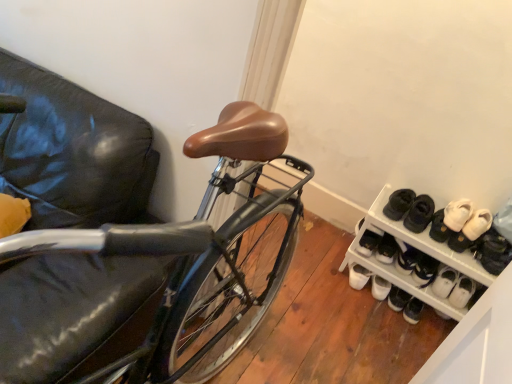
Question: Considering the relative positions of white suede sneakers at lower right, positioned as the 1th footwear in right-to-left order, and white suede shoes at right, which ranks as the 2th footwear in left-to-right order, in the image provided, is white suede sneakers at lower right, positioned as the 1th footwear in right-to-left order, to the right of white suede shoes at right, which ranks as the 2th footwear in left-to-right order, from the viewer's perspective?

Choices:
 (A) yes
 (B) no

Answer: (A)

Question: Is white suede sneakers at lower right, positioned as the 1th footwear in right-to-left order, facing towards white suede shoes at right, which is counted as the 3th footwear, starting from the right?

Choices:
 (A) yes
 (B) no

Answer: (B)

Question: Is white suede sneakers at lower right, which ranks as the 4th footwear in left-to-right order, turned away from white suede shoes at right, which ranks as the 2th footwear in left-to-right order?

Choices:
 (A) no
 (B) yes

Answer: (A)

Question: From a real-world perspective, is white suede sneakers at lower right, positioned as the 1th footwear in right-to-left order, positioned under white suede shoes at right, which is counted as the 3th footwear, starting from the right, based on gravity?

Choices:
 (A) yes
 (B) no

Answer: (B)

Question: Does white suede sneakers at lower right, which ranks as the 4th footwear in left-to-right order, have a lesser height compared to white suede shoes at right, which ranks as the 2th footwear in left-to-right order?

Choices:
 (A) no
 (B) yes

Answer: (A)

Question: Does point (463, 339) appear closer or farther from the camera than point (501, 249)?

Choices:
 (A) closer
 (B) farther

Answer: (A)

Question: Is white plastic shoe rack at lower right in front of or behind white suede sneakers at lower right, positioned as the 1th footwear in right-to-left order, in the image?

Choices:
 (A) behind
 (B) front

Answer: (B)

Question: Is white plastic shoe rack at lower right to the left or to the right of white suede sneakers at lower right, which ranks as the 4th footwear in left-to-right order, in the image?

Choices:
 (A) right
 (B) left

Answer: (B)

Question: From their relative heights in the image, would you say white plastic shoe rack at lower right is taller or shorter than white suede sneakers at lower right, positioned as the 1th footwear in right-to-left order?

Choices:
 (A) short
 (B) tall

Answer: (B)

Question: Considering the positions of white suede sneakers at lower right, which ranks as the 4th footwear in left-to-right order, and white suede sneakers at lower right, the first footwear in the left-to-right sequence, in the image, is white suede sneakers at lower right, which ranks as the 4th footwear in left-to-right order, taller or shorter than white suede sneakers at lower right, the first footwear in the left-to-right sequence,?

Choices:
 (A) short
 (B) tall

Answer: (B)

Question: From the image's perspective, is white suede sneakers at lower right, positioned as the 1th footwear in right-to-left order, above or below white suede sneakers at lower right, the first footwear in the left-to-right sequence?

Choices:
 (A) above
 (B) below

Answer: (B)

Question: Would you say white suede sneakers at lower right, which ranks as the 4th footwear in left-to-right order, is to the left or to the right of white suede sneakers at lower right, the first footwear in the left-to-right sequence, in the picture?

Choices:
 (A) left
 (B) right

Answer: (B)

Question: Do you think white suede sneakers at lower right, which ranks as the 4th footwear in left-to-right order, is within white suede sneakers at lower right, which appears as the fourth footwear when viewed from the right, or outside of it?

Choices:
 (A) inside
 (B) outside

Answer: (B)

Question: Visually, is white suede sneakers at lower right, the first footwear in the left-to-right sequence, positioned to the left or to the right of white plastic shoe rack at lower right?

Choices:
 (A) right
 (B) left

Answer: (B)

Question: Choose the correct answer: Is white suede sneakers at lower right, which appears as the fourth footwear when viewed from the right, inside white plastic shoe rack at lower right or outside it?

Choices:
 (A) outside
 (B) inside

Answer: (B)